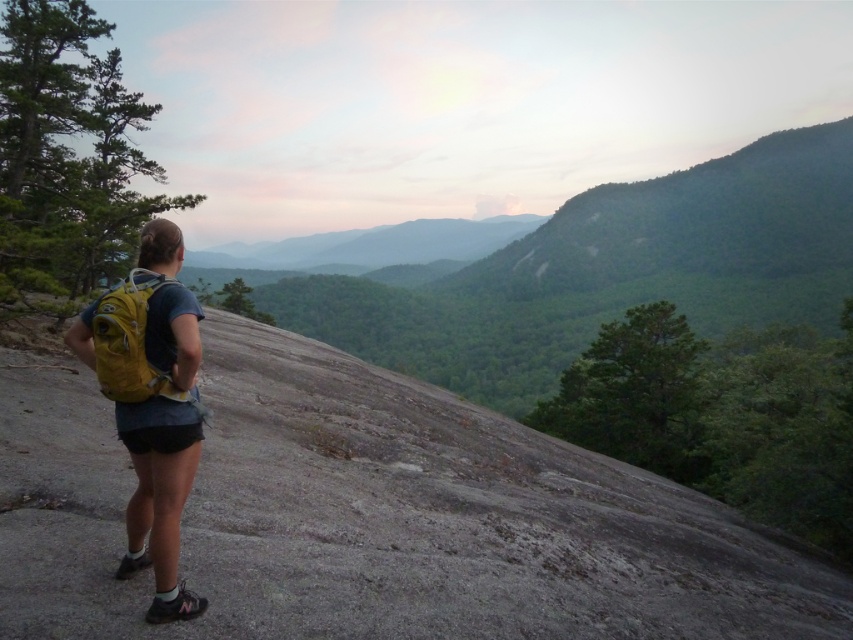
Consider the image. Can you confirm if yellow fabric backpack at left is positioned below yellow fabric backpack at center?

Indeed, yellow fabric backpack at left is positioned under yellow fabric backpack at center.

Does yellow fabric backpack at left come behind yellow fabric backpack at center?

That is False.

Which is in front, point (144, 312) or point (113, 333)?

Point (113, 333) is in front.

Find the location of `yellow fabric backpack at left`. yellow fabric backpack at left is located at coordinates (151, 403).